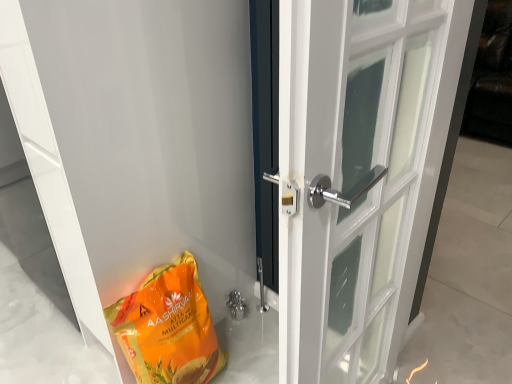
Question: From the image's perspective, would you say orange matte/glossy grocery bag at lower left is shown under polished chrome door handle at center, marked as the second door in a left-to-right arrangement?

Choices:
 (A) no
 (B) yes

Answer: (B)

Question: From a real-world perspective, is orange matte/glossy grocery bag at lower left over polished chrome door handle at center, which is the first door in right-to-left order?

Choices:
 (A) yes
 (B) no

Answer: (A)

Question: Can you confirm if orange matte/glossy grocery bag at lower left is shorter than polished chrome door handle at center, which is the first door in right-to-left order?

Choices:
 (A) yes
 (B) no

Answer: (B)

Question: Is orange matte/glossy grocery bag at lower left behind polished chrome door handle at center, which is the first door in right-to-left order?

Choices:
 (A) no
 (B) yes

Answer: (A)

Question: Considering the relative sizes of orange matte/glossy grocery bag at lower left and polished chrome door handle at center, marked as the second door in a left-to-right arrangement, in the image provided, is orange matte/glossy grocery bag at lower left smaller than polished chrome door handle at center, marked as the second door in a left-to-right arrangement,?

Choices:
 (A) yes
 (B) no

Answer: (A)

Question: In terms of width, does white glossy door at lower left, positioned as the second door in right-to-left order, look wider or thinner when compared to polished chrome door handle at center, which is the first door in right-to-left order?

Choices:
 (A) thin
 (B) wide

Answer: (A)

Question: Considering the positions of white glossy door at lower left, positioned as the second door in right-to-left order, and polished chrome door handle at center, marked as the second door in a left-to-right arrangement, in the image, is white glossy door at lower left, positioned as the second door in right-to-left order, bigger or smaller than polished chrome door handle at center, marked as the second door in a left-to-right arrangement,?

Choices:
 (A) big
 (B) small

Answer: (A)

Question: Is white glossy door at lower left, positioned as the first door in left-to-right order, situated inside polished chrome door handle at center, marked as the second door in a left-to-right arrangement, or outside?

Choices:
 (A) inside
 (B) outside

Answer: (B)

Question: Considering the positions of point (106, 119) and point (332, 165), is point (106, 119) closer or farther from the camera than point (332, 165)?

Choices:
 (A) closer
 (B) farther

Answer: (B)

Question: In the image, is polished chrome door handle at center, which is the first door in right-to-left order, positioned in front of or behind orange matte/glossy grocery bag at lower left?

Choices:
 (A) front
 (B) behind

Answer: (B)

Question: Is point (x=282, y=238) closer or farther from the camera than point (x=164, y=354)?

Choices:
 (A) farther
 (B) closer

Answer: (B)

Question: In terms of height, does polished chrome door handle at center, which is the first door in right-to-left order, look taller or shorter compared to orange matte/glossy grocery bag at lower left?

Choices:
 (A) tall
 (B) short

Answer: (B)

Question: Is polished chrome door handle at center, marked as the second door in a left-to-right arrangement, situated inside orange matte/glossy grocery bag at lower left or outside?

Choices:
 (A) inside
 (B) outside

Answer: (B)

Question: From a real-world perspective, is orange matte/glossy grocery bag at lower left above or below polished chrome door handle at center, which is the first door in right-to-left order?

Choices:
 (A) above
 (B) below

Answer: (A)

Question: Is orange matte/glossy grocery bag at lower left situated inside polished chrome door handle at center, which is the first door in right-to-left order, or outside?

Choices:
 (A) outside
 (B) inside

Answer: (A)